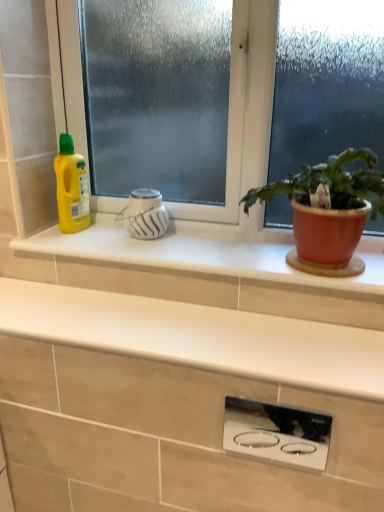
Question: Is matte terracotta pot at right next to polished stainless steel cooktop at center, acting as the 1th appliance starting from the front?

Choices:
 (A) no
 (B) yes

Answer: (A)

Question: Does matte terracotta pot at right come in front of polished stainless steel cooktop at center, which is the 1th appliance from bottom to top?

Choices:
 (A) yes
 (B) no

Answer: (A)

Question: Is matte terracotta pot at right behind polished stainless steel cooktop at center, positioned as the second appliance in left-to-right order?

Choices:
 (A) no
 (B) yes

Answer: (A)

Question: From a real-world perspective, is matte terracotta pot at right over polished stainless steel cooktop at center, arranged as the second appliance when viewed from the back?

Choices:
 (A) yes
 (B) no

Answer: (A)

Question: Considering the relative sizes of matte terracotta pot at right and polished stainless steel cooktop at center, arranged as the second appliance when viewed from the back, in the image provided, is matte terracotta pot at right smaller than polished stainless steel cooktop at center, arranged as the second appliance when viewed from the back,?

Choices:
 (A) yes
 (B) no

Answer: (B)

Question: From the image's perspective, is frosted glass window at center located above or below white glossy window sill at center?

Choices:
 (A) below
 (B) above

Answer: (B)

Question: Is frosted glass window at center wider or thinner than white glossy window sill at center?

Choices:
 (A) wide
 (B) thin

Answer: (B)

Question: Considering the positions of frosted glass window at center and white glossy window sill at center in the image, is frosted glass window at center taller or shorter than white glossy window sill at center?

Choices:
 (A) tall
 (B) short

Answer: (A)

Question: Is point (100, 161) closer or farther from the camera than point (259, 258)?

Choices:
 (A) farther
 (B) closer

Answer: (A)

Question: Is point (59, 150) positioned closer to the camera than point (291, 474)?

Choices:
 (A) closer
 (B) farther

Answer: (B)

Question: Is yellow plastic bottle at left wider or thinner than white matte countertop at center?

Choices:
 (A) thin
 (B) wide

Answer: (A)

Question: Considering the positions of yellow plastic bottle at left and white matte countertop at center in the image, is yellow plastic bottle at left taller or shorter than white matte countertop at center?

Choices:
 (A) short
 (B) tall

Answer: (B)

Question: Is yellow plastic bottle at left in front of or behind white matte countertop at center in the image?

Choices:
 (A) front
 (B) behind

Answer: (B)

Question: Would you say polished stainless steel cooktop at center, arranged as the second appliance when viewed from the back, is inside or outside white glossy vase at center, acting as the 1th appliance starting from the top?

Choices:
 (A) inside
 (B) outside

Answer: (B)

Question: Based on their positions, is polished stainless steel cooktop at center, the 2th appliance when ordered from top to bottom, located to the left or right of white glossy vase at center, the first appliance positioned from the back?

Choices:
 (A) left
 (B) right

Answer: (B)